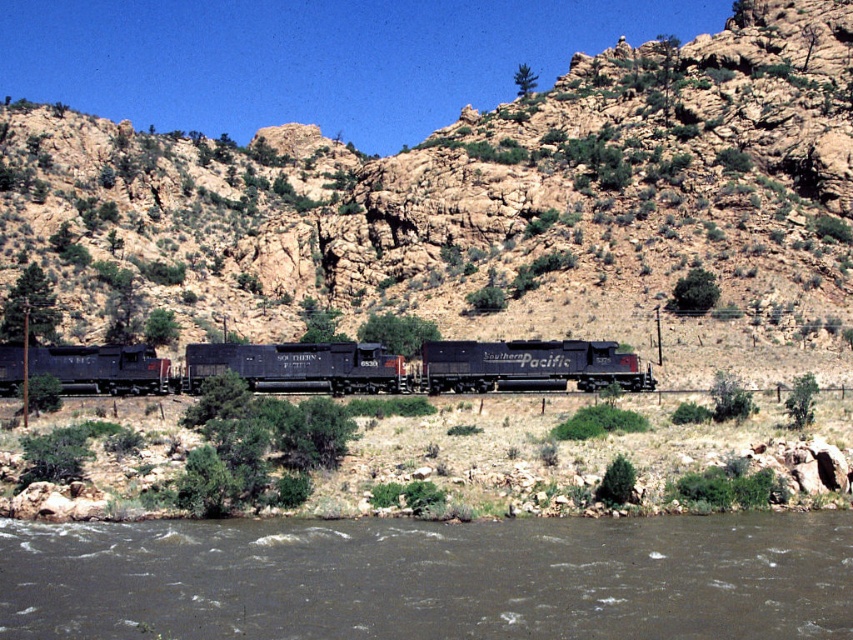
Question: Which point appears farthest from the camera in this image?

Choices:
 (A) (503, 468)
 (B) (612, 349)

Answer: (B)

Question: Is brown dirt at lower center positioned behind matte black locomotive at center?

Choices:
 (A) no
 (B) yes

Answer: (A)

Question: Which point is closer to the camera?

Choices:
 (A) (344, 403)
 (B) (35, 349)

Answer: (A)

Question: Is brown muddy water at lower center further to camera compared to matte black locomotive at center?

Choices:
 (A) yes
 (B) no

Answer: (B)

Question: Estimate the real-world distances between objects in this image. Which object is farther from the brown dirt at lower center?

Choices:
 (A) brown muddy water at lower center
 (B) matte black locomotive at center

Answer: (B)

Question: Is brown dirt at lower center above matte black locomotive at center?

Choices:
 (A) no
 (B) yes

Answer: (A)